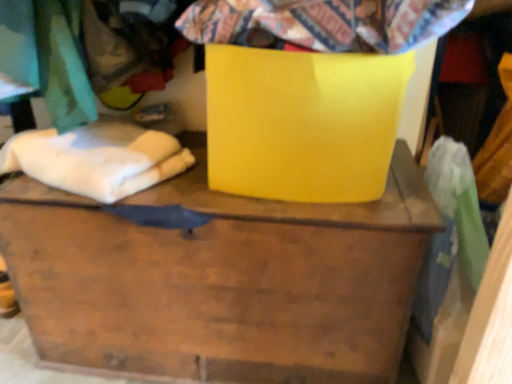
Question: Is white soft cloth at left to the left or to the right of flannel fabric at upper center in the image?

Choices:
 (A) right
 (B) left

Answer: (B)

Question: Is point (69, 165) positioned closer to the camera than point (214, 11)?

Choices:
 (A) closer
 (B) farther

Answer: (B)

Question: Based on their relative distances, which object is farther from the flannel fabric at upper center?

Choices:
 (A) glossy yellow cardboard box at center
 (B) white soft cloth at left
 (C) matte yellow container at center

Answer: (C)

Question: Estimate the real-world distances between objects in this image. Which object is closer to the glossy yellow cardboard box at center?

Choices:
 (A) white soft cloth at left
 (B) flannel fabric at upper center
 (C) matte yellow container at center

Answer: (B)